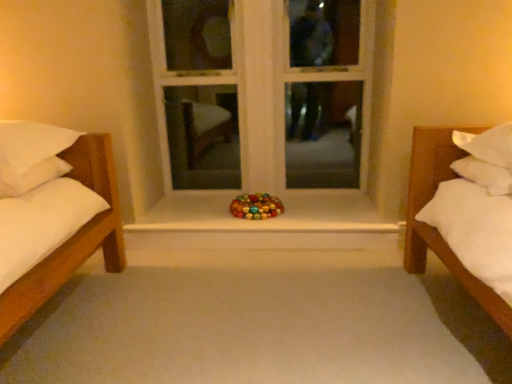
The width and height of the screenshot is (512, 384). Identify the location of white soft pillow at left. (31, 155).

The width and height of the screenshot is (512, 384). What do you see at coordinates (268, 218) in the screenshot?
I see `smooth white surface at center` at bounding box center [268, 218].

Locate an element on the screen. This screenshot has height=384, width=512. white wood window frame at center is located at coordinates pos(266,75).

Measure the distance between glossy plastic toy at center and smooth white surface at center.

A distance of 9.27 inches exists between glossy plastic toy at center and smooth white surface at center.

Which object is thinner, glossy plastic toy at center or smooth white surface at center?

glossy plastic toy at center is thinner.

Considering the relative positions of glossy plastic toy at center and smooth white surface at center in the image provided, is glossy plastic toy at center behind smooth white surface at center?

That is True.

Is there a large distance between glossy plastic toy at center and smooth white surface at center?

glossy plastic toy at center is near smooth white surface at center, not far away.

From the image's perspective, which is below, glossy plastic toy at center or white wood window frame at center?

From the image's view, glossy plastic toy at center is below.

Is glossy plastic toy at center facing away from white wood window frame at center?

Correct, glossy plastic toy at center is looking away from white wood window frame at center.

In terms of size, does glossy plastic toy at center appear bigger or smaller than white wood window frame at center?

Considering their sizes, glossy plastic toy at center takes up less space than white wood window frame at center.

Is glossy plastic toy at center placed right next to white wood window frame at center?

No, glossy plastic toy at center is not making contact with white wood window frame at center.

From the picture: Which is behind, white soft pillow at left or glossy plastic toy at center?

Positioned behind is glossy plastic toy at center.

From a real-world perspective, is white soft pillow at left positioned above or below glossy plastic toy at center?

white soft pillow at left is situated higher than glossy plastic toy at center in the real world.

Is white soft pillow at left far away from glossy plastic toy at center?

Yes, white soft pillow at left and glossy plastic toy at center are located far from each other.

Is white soft pillow at left positioned beyond the bounds of glossy plastic toy at center?

Yes, white soft pillow at left is outside of glossy plastic toy at center.

Can you tell me how much glossy plastic toy at center and white soft pillow at left differ in facing direction?

There is a 159-degree angle between the facing directions of glossy plastic toy at center and white soft pillow at left.

Consider the image. Is glossy plastic toy at center inside or outside of white soft pillow at left?

The correct answer is: outside.

From the image's perspective, is glossy plastic toy at center located beneath white soft pillow at left?

Yes.

From the picture: Considering the sizes of objects glossy plastic toy at center and white soft pillow at left in the image provided, who is taller, glossy plastic toy at center or white soft pillow at left?

With more height is white soft pillow at left.

Which object is wider, white wood window frame at center or white soft pillow at left?

white soft pillow at left.

Between white wood window frame at center and white soft pillow at left, which one has larger size?

Bigger between the two is white wood window frame at center.

Between point (333, 33) and point (57, 138), which one is positioned in front?

The point (57, 138) is in front.

Which of these two, white soft pillow at left or smooth white surface at center, is bigger?

Bigger between the two is white soft pillow at left.

Between white soft pillow at left and smooth white surface at center, which one has larger width?

With larger width is smooth white surface at center.

From the image's perspective, is white soft pillow at left under smooth white surface at center?

No, from the image's perspective, white soft pillow at left is not beneath smooth white surface at center.

Would you consider white soft pillow at left to be distant from smooth white surface at center?

That's not correct — white soft pillow at left is a little close to smooth white surface at center.

Which of these two, smooth white surface at center or white wood window frame at center, is bigger?

With larger size is white wood window frame at center.

Between smooth white surface at center and white wood window frame at center, which one has smaller width?

Thinner between the two is white wood window frame at center.

Considering their positions, is smooth white surface at center located in front of or behind white wood window frame at center?

smooth white surface at center is positioned closer to the viewer than white wood window frame at center.

Is smooth white surface at center beside white wood window frame at center?

smooth white surface at center and white wood window frame at center are not in contact.

The height and width of the screenshot is (384, 512). In order to click on window sill that appears in front of the glossy plastic toy at center in this screenshot , I will do `click(268, 218)`.

Locate an element on the screen. window frame located behind the glossy plastic toy at center is located at coordinates (266, 75).

Based on the photo, based on their spatial positions, is white wood window frame at center or glossy plastic toy at center further from white soft pillow at left?

white wood window frame at center is positioned further to the anchor white soft pillow at left.

Considering their positions, is smooth white surface at center positioned closer to glossy plastic toy at center than white wood window frame at center?

smooth white surface at center lies closer to glossy plastic toy at center than the other object.

Based on the photo, when comparing their distances from glossy plastic toy at center, does smooth white surface at center or white soft pillow at left seem closer?

smooth white surface at center is closer to glossy plastic toy at center.

Considering their positions, is white wood window frame at center positioned further to smooth white surface at center than white soft pillow at left?

Among the two, white soft pillow at left is located further to smooth white surface at center.

Looking at the image, which one is located closer to glossy plastic toy at center, white soft pillow at left or white wood window frame at center?

The object closer to glossy plastic toy at center is white wood window frame at center.

When comparing their distances from smooth white surface at center, does white soft pillow at left or white wood window frame at center seem closer?

white wood window frame at center.

Estimate the real-world distances between objects in this image. Which object is further from smooth white surface at center, white soft pillow at left or glossy plastic toy at center?

Based on the image, white soft pillow at left appears to be further to smooth white surface at center.

From the picture: Which object lies further to the anchor point white wood window frame at center, smooth white surface at center or glossy plastic toy at center?

glossy plastic toy at center lies further to white wood window frame at center than the other object.

Locate an element on the screen. The image size is (512, 384). toy between white soft pillow at left and white wood window frame at center is located at coordinates (256, 206).

The width and height of the screenshot is (512, 384). In order to click on window sill between white soft pillow at left and white wood window frame at center in the horizontal direction in this screenshot , I will do `click(268, 218)`.

The image size is (512, 384). What are the coordinates of `toy between white wood window frame at center and smooth white surface at center vertically` in the screenshot? It's located at (256, 206).

This screenshot has height=384, width=512. I want to click on toy located between white soft pillow at left and smooth white surface at center in the left-right direction, so coord(256,206).